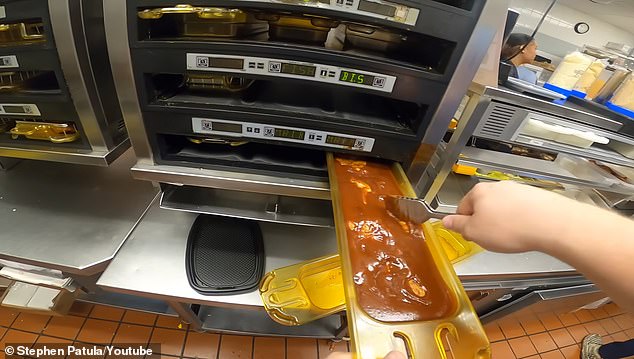
Where is `bottom oven slot`? The width and height of the screenshot is (634, 359). bottom oven slot is located at coordinates point(276,158).